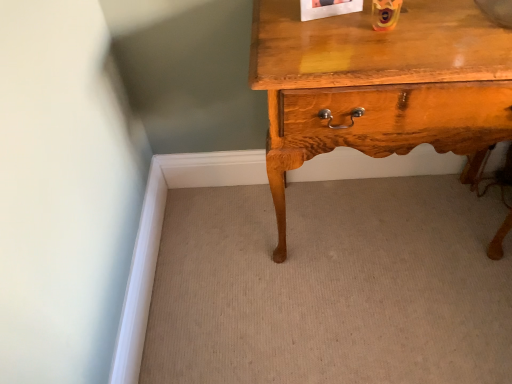
You are a GUI agent. You are given a task and a screenshot of the screen. Output one action in this format:
    pyautogui.click(x=<x>, y=<y>)
    Task: Click on the free point above glossy wood nightstand at right (from a real-world perspective)
    
    Given the screenshot: What is the action you would take?
    pyautogui.click(x=406, y=25)